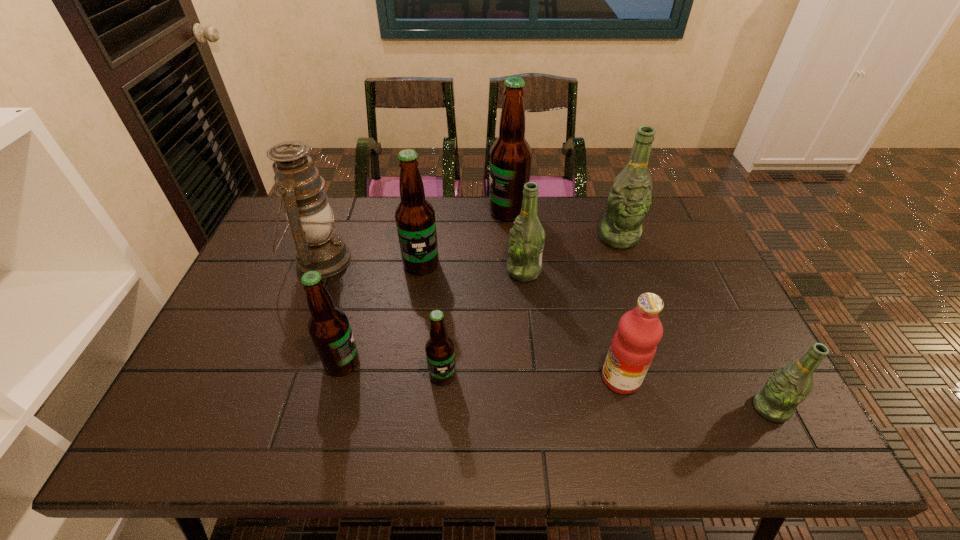
The image size is (960, 540). What are the coordinates of `the tallest beer bottle` in the screenshot? It's located at (510, 156).

Identify the location of the rightmost brown beer bottle. (510, 156).

Where is `the leftmost object`? the leftmost object is located at coordinates (298, 183).

Locate an element on the screen. the second farthest beer bottle is located at coordinates [x=628, y=202].

Where is `the second beer bottle from right to left`? Image resolution: width=960 pixels, height=540 pixels. the second beer bottle from right to left is located at coordinates (628, 202).

Where is `the seventh object from right to left`? This screenshot has height=540, width=960. the seventh object from right to left is located at coordinates (415, 217).

What are the coordinates of `the second beer bottle from left to right` in the screenshot? It's located at (415, 217).

Identify the location of the second smallest green beer bottle. The height and width of the screenshot is (540, 960). (526, 241).

The height and width of the screenshot is (540, 960). I want to click on the leftmost green beer bottle, so click(526, 241).

Find the location of `the leftmost beer bottle`. the leftmost beer bottle is located at coordinates (329, 328).